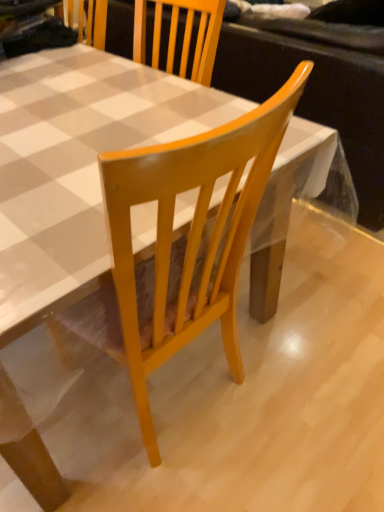
You are a GUI agent. You are given a task and a screenshot of the screen. Output one action in this format:
    pyautogui.click(x=<x>, y=<y>)
    Task: Click on the matte wood table at center
    The height and width of the screenshot is (512, 384).
    Given the screenshot: What is the action you would take?
    pyautogui.click(x=76, y=165)

This screenshot has height=512, width=384. Describe the element at coordinates (76, 165) in the screenshot. I see `matte wood table at center` at that location.

What is the approximate width of matte wood table at center?

23.36 inches.

Based on the photo, measure the distance between matte wood table at center and camera.

The depth of matte wood table at center is 26.34 inches.

Locate an element on the screen. matte wood table at center is located at coordinates (76, 165).